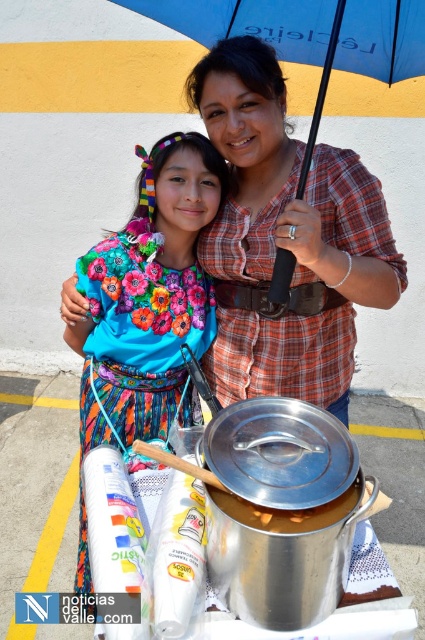
Question: Is blue fabric umbrella at upper center further to the viewer compared to shiny silver pot at center?

Choices:
 (A) yes
 (B) no

Answer: (A)

Question: Which point is farther to the camera?

Choices:
 (A) floral fabric dress at center
 (B) shiny silver pot at center
 (C) plaid fabric shirt at center

Answer: (A)

Question: Is plaid fabric shirt at center to the left of floral fabric dress at center from the viewer's perspective?

Choices:
 (A) yes
 (B) no

Answer: (B)

Question: Which object appears farthest from the camera in this image?

Choices:
 (A) blue fabric umbrella at upper center
 (B) shiny silver pot at center
 (C) plaid fabric shirt at center
 (D) floral fabric dress at center

Answer: (D)

Question: Among these points, which one is farthest from the camera?

Choices:
 (A) (218, 333)
 (B) (99, 266)

Answer: (A)

Question: Is plaid fabric shirt at center to the right of floral fabric dress at center from the viewer's perspective?

Choices:
 (A) yes
 (B) no

Answer: (A)